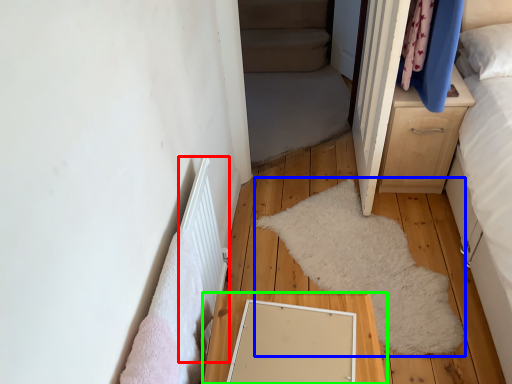
Question: Which object is positioned closest to radiator (highlighted by a red box)? Select from mat (highlighted by a blue box) and table (highlighted by a green box).

Choices:
 (A) mat
 (B) table

Answer: (B)